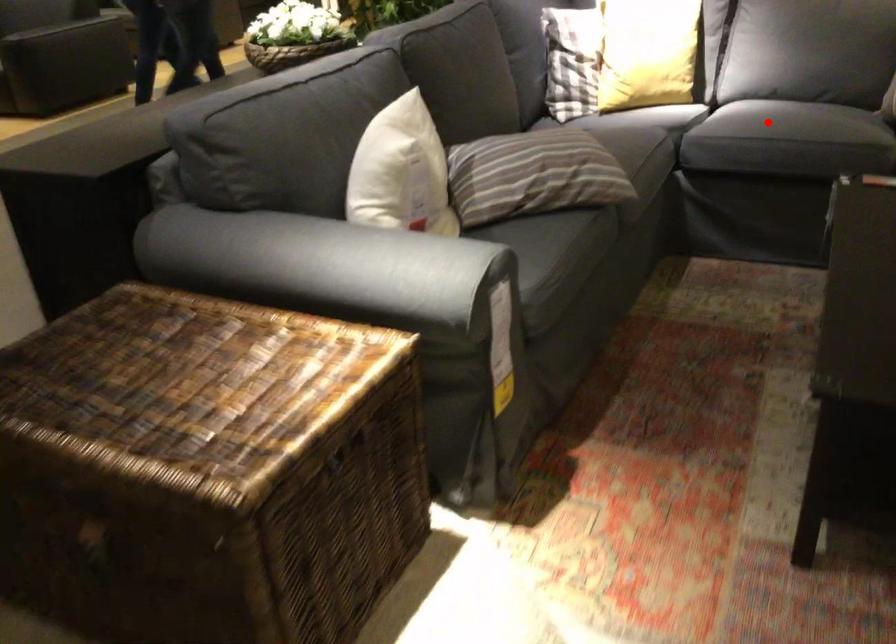
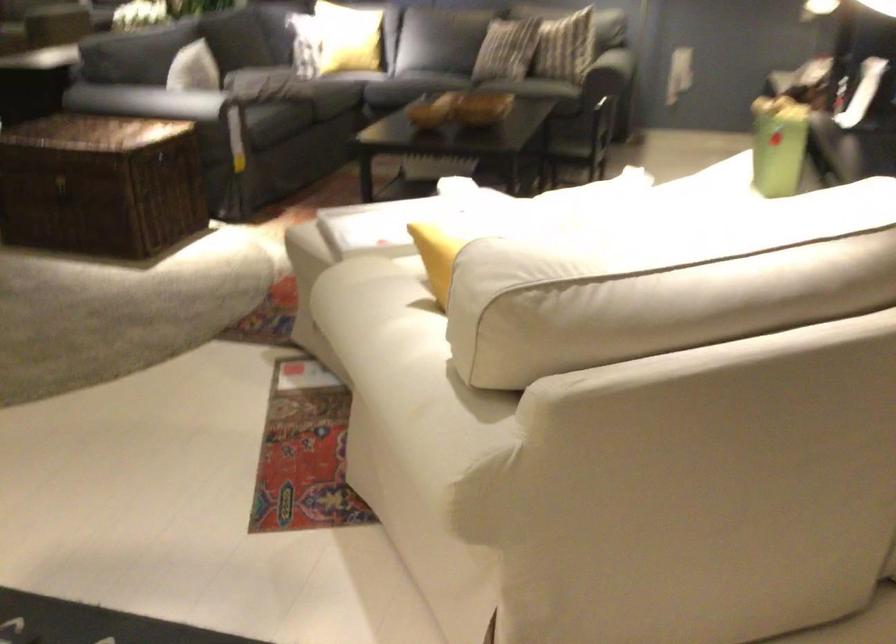
Question: I am providing you with two images of the same scene from different viewpoints. A red point is marked on the first image. Can you still see the location of the red point in image 2?

Choices:
 (A) Yes
 (B) No

Answer: (B)